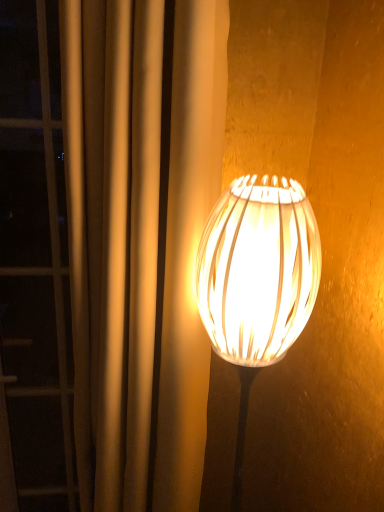
Measure the distance between translucent white lampshade at center and camera.

20.97 inches.

Locate an element on the screen. The height and width of the screenshot is (512, 384). translucent white lampshade at center is located at coordinates (257, 281).

Looking at this image, what is the approximate height of translucent white lampshade at center?

It is 28.00 inches.

Measure the distance between point (251,319) and camera.

Point (251,319) and camera are 59.40 centimeters apart from each other.

This screenshot has width=384, height=512. What do you see at coordinates (257, 281) in the screenshot?
I see `translucent white lampshade at center` at bounding box center [257, 281].

Where is `silky beige curtain at right`? silky beige curtain at right is located at coordinates (113, 236).

The width and height of the screenshot is (384, 512). What do you see at coordinates (113, 236) in the screenshot? I see `silky beige curtain at right` at bounding box center [113, 236].

At what (x,y) coordinates should I click in order to perform the action: click on translucent white lampshade at center. Please return your answer as a coordinate pair (x, y). Looking at the image, I should click on (257, 281).

Which object is positioned more to the left, silky beige curtain at right or translucent white lampshade at center?

From the viewer's perspective, silky beige curtain at right appears more on the left side.

Is silky beige curtain at right in front of or behind translucent white lampshade at center in the image?

silky beige curtain at right is positioned farther from the viewer than translucent white lampshade at center.

Which is behind, point (100, 225) or point (312, 284)?

The point (312, 284) is behind.

From the image's perspective, who appears lower, silky beige curtain at right or translucent white lampshade at center?

translucent white lampshade at center appears lower in the image.

From a real-world perspective, between silky beige curtain at right and translucent white lampshade at center, who is vertically higher?

translucent white lampshade at center, from a real-world perspective.

Which object is thinner, silky beige curtain at right or translucent white lampshade at center?

Thinner between the two is translucent white lampshade at center.

Can you confirm if silky beige curtain at right is taller than translucent white lampshade at center?

Indeed, silky beige curtain at right has a greater height compared to translucent white lampshade at center.

In terms of size, does silky beige curtain at right appear bigger or smaller than translucent white lampshade at center?

silky beige curtain at right is bigger than translucent white lampshade at center.

Would you say silky beige curtain at right is inside or outside translucent white lampshade at center?

silky beige curtain at right exists outside the volume of translucent white lampshade at center.

Are silky beige curtain at right and translucent white lampshade at center beside each other?

No, silky beige curtain at right is not beside translucent white lampshade at center.

Could you tell me if silky beige curtain at right is turned towards translucent white lampshade at center?

No, silky beige curtain at right is not oriented towards translucent white lampshade at center.

In the scene shown: Can you tell me how much silky beige curtain at right and translucent white lampshade at center differ in facing direction?

They differ by 51.5 degrees in their facing directions.

Where is `lamp below the silky beige curtain at right (from the image's perspective)`? lamp below the silky beige curtain at right (from the image's perspective) is located at coordinates (257, 281).

Which object is positioned more to the right, translucent white lampshade at center or silky beige curtain at right?

translucent white lampshade at center is more to the right.

Considering their positions, is translucent white lampshade at center located in front of or behind silky beige curtain at right?

In the image, translucent white lampshade at center appears in front of silky beige curtain at right.

Which is less distant, (227,218) or (197,159)?

The point (227,218) is in front.

From the image's perspective, would you say translucent white lampshade at center is positioned over silky beige curtain at right?

Actually, translucent white lampshade at center appears below silky beige curtain at right in the image.

From a real-world perspective, relative to silky beige curtain at right, is translucent white lampshade at center vertically above or below?

translucent white lampshade at center is above silky beige curtain at right.

Considering the sizes of objects translucent white lampshade at center and silky beige curtain at right in the image provided, who is wider, translucent white lampshade at center or silky beige curtain at right?

With larger width is silky beige curtain at right.

Between translucent white lampshade at center and silky beige curtain at right, which one has less height?

With less height is translucent white lampshade at center.

Is translucent white lampshade at center bigger or smaller than silky beige curtain at right?

translucent white lampshade at center is smaller than silky beige curtain at right.

Is translucent white lampshade at center not within silky beige curtain at right?

Yes.

Is translucent white lampshade at center far from silky beige curtain at right?

translucent white lampshade at center is near silky beige curtain at right, not far away.

Does translucent white lampshade at center turn towards silky beige curtain at right?

No, translucent white lampshade at center is not turned towards silky beige curtain at right.

What's the angular difference between translucent white lampshade at center and silky beige curtain at right's facing directions?

51.5 degrees separate the facing orientations of translucent white lampshade at center and silky beige curtain at right.

In the image, there is a silky beige curtain at right. Identify the location of lamp below it (from the image's perspective). Image resolution: width=384 pixels, height=512 pixels. (257, 281).

You are a GUI agent. You are given a task and a screenshot of the screen. Output one action in this format:
    pyautogui.click(x=<x>, y=<y>)
    Task: Click on the lamp lying in front of the silky beige curtain at right
    
    Given the screenshot: What is the action you would take?
    pyautogui.click(x=257, y=281)

At what (x,y) coordinates should I click in order to perform the action: click on curtain below the translucent white lampshade at center (from a real-world perspective). Please return your answer as a coordinate pair (x, y). Looking at the image, I should click on (x=113, y=236).